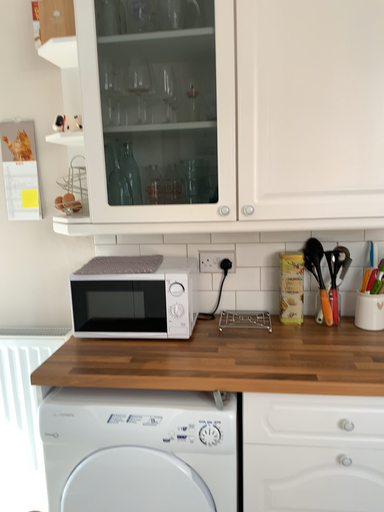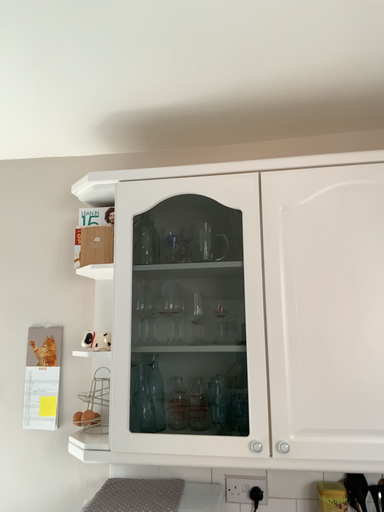
Question: Which way did the camera rotate in the video?

Choices:
 (A) rotated upward
 (B) rotated downward

Answer: (A)